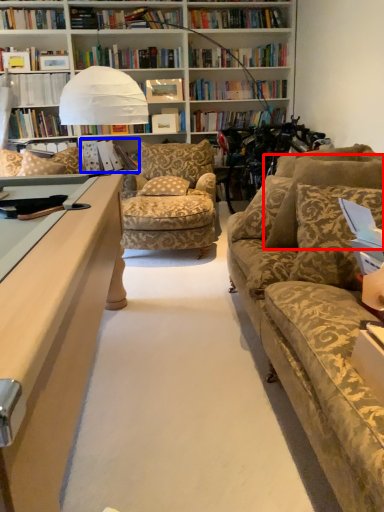
Question: Which point is further to the camera, pillow (highlighted by a red box) or book (highlighted by a blue box)?

Choices:
 (A) pillow
 (B) book

Answer: (B)